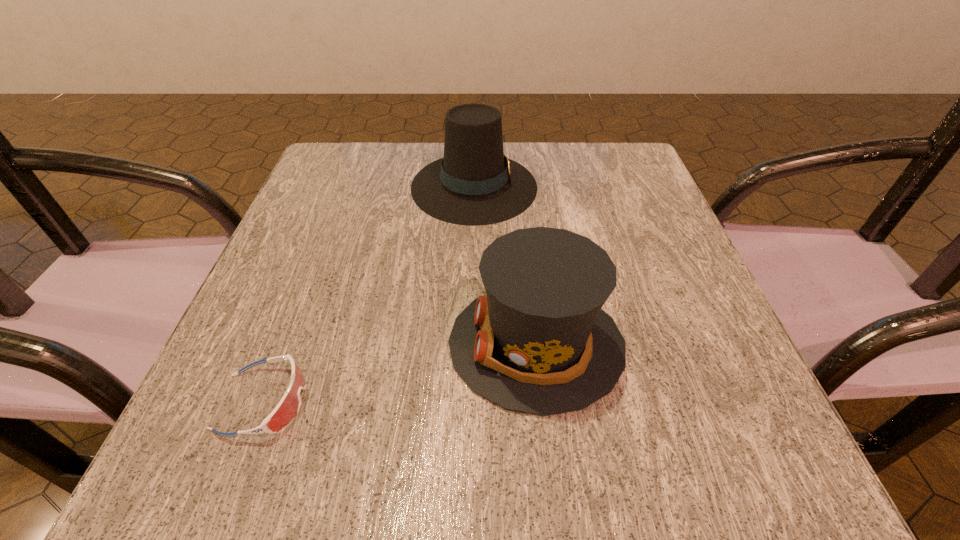
Image resolution: width=960 pixels, height=540 pixels. I want to click on object situated at the near edge, so click(x=288, y=407).

What are the coordinates of `object at the left edge` in the screenshot? It's located at (x=288, y=407).

Locate an element on the screen. object positioned at the right edge is located at coordinates (538, 342).

Find the location of a particular element. The width and height of the screenshot is (960, 540). object that is positioned at the near left corner is located at coordinates (288, 407).

At what (x,y) coordinates should I click in order to perform the action: click on vacant space at the far edge. Please return your answer as a coordinate pair (x, y). Image resolution: width=960 pixels, height=540 pixels. Looking at the image, I should click on (388, 174).

Image resolution: width=960 pixels, height=540 pixels. In order to click on free region at the near edge of the desktop in this screenshot , I will do `click(581, 466)`.

I want to click on free spot at the left edge of the desktop, so click(x=325, y=208).

In order to click on vacant space at the right edge of the desktop in this screenshot , I will do (x=720, y=353).

Find the location of a particular element. vacant area at the far left corner is located at coordinates (339, 192).

I want to click on vacant space at the near right corner, so click(786, 461).